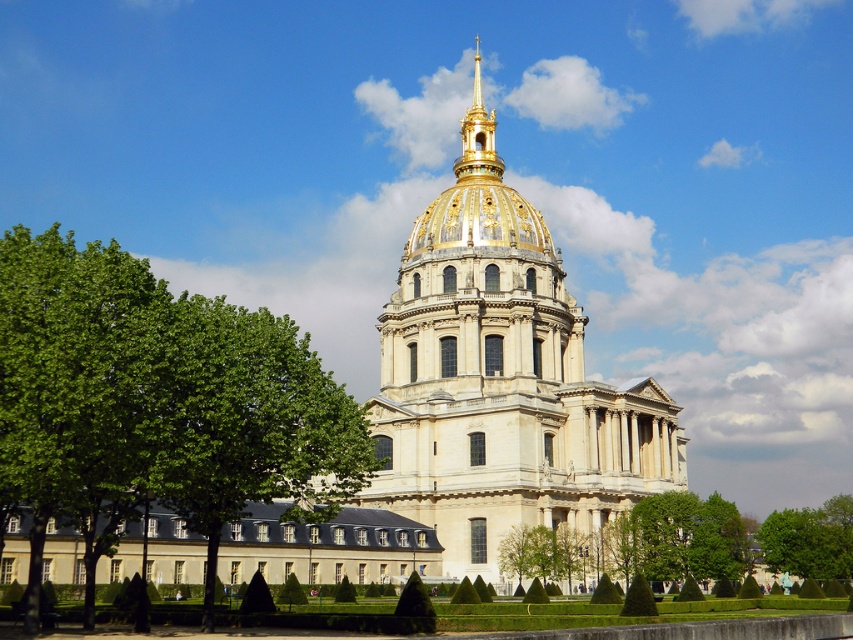
Question: Which of the following is the closest to the observer?

Choices:
 (A) (791, 522)
 (B) (38, 333)
 (C) (486, 236)
 (D) (489, 134)

Answer: (B)

Question: Which point is closer to the camera?

Choices:
 (A) gold plated spire at upper center
 (B) green leafy tree at left
 (C) golden dome building at center
 (D) green leafy tree at lower right

Answer: (B)

Question: Considering the relative positions of golden dome building at center and green leafy tree at lower right in the image provided, where is golden dome building at center located with respect to green leafy tree at lower right?

Choices:
 (A) below
 (B) above

Answer: (B)

Question: From the image, what is the correct spatial relationship of golden dome building at center in relation to green leafy tree at lower right?

Choices:
 (A) right
 (B) left

Answer: (B)

Question: Does green leafy tree at left have a smaller size compared to green leafy tree at lower right?

Choices:
 (A) yes
 (B) no

Answer: (B)

Question: Which object is positioned farthest from the green leafy tree at left?

Choices:
 (A) green leafy tree at lower right
 (B) gold plated spire at upper center

Answer: (B)